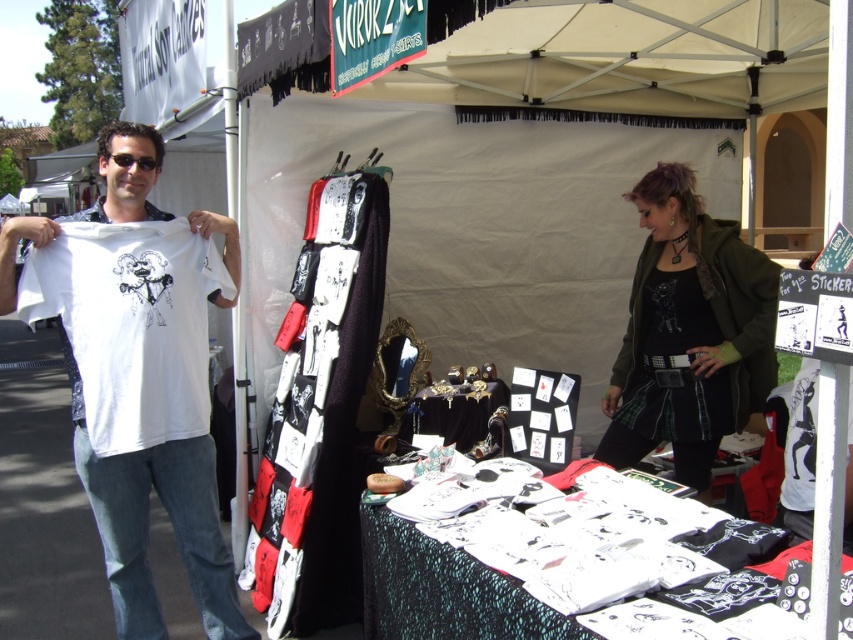
Question: Which object appears farthest from the camera in this image?

Choices:
 (A) matte olive green jacket at center
 (B) white matte t-shirt at left
 (C) white paper at center
 (D) white cotton t-shirt at left

Answer: (A)

Question: Which object is positioned farthest from the white matte t-shirt at left?

Choices:
 (A) matte olive green jacket at center
 (B) white paper at center

Answer: (A)

Question: Is matte olive green jacket at center closer to camera compared to white paper at center?

Choices:
 (A) no
 (B) yes

Answer: (A)

Question: Does matte olive green jacket at center appear on the right side of white cotton t-shirt at left?

Choices:
 (A) no
 (B) yes

Answer: (B)

Question: Considering the real-world distances, which object is closest to the white matte t-shirt at left?

Choices:
 (A) white cotton t-shirt at left
 (B) white paper at center
 (C) matte olive green jacket at center

Answer: (A)

Question: Does white cotton t-shirt at left appear on the right side of white paper at center?

Choices:
 (A) yes
 (B) no

Answer: (B)